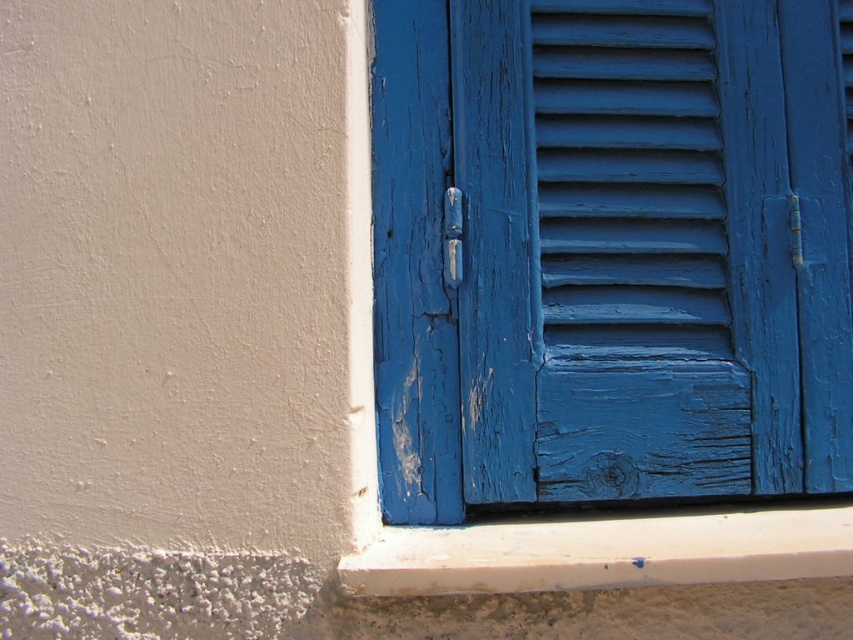
Can you confirm if blue painted wood shutter at center is positioned to the left of blue painted wood shutter at right?

In fact, blue painted wood shutter at center is to the right of blue painted wood shutter at right.

Is blue painted wood shutter at center in front of blue painted wood shutter at right?

No, it is not.

The image size is (853, 640). Describe the element at coordinates (633, 256) in the screenshot. I see `blue painted wood shutter at center` at that location.

I want to click on blue painted wood shutter at center, so click(x=633, y=256).

Does blue painted wood shutter at right have a greater width compared to white matte window sill at lower center?

No.

Does blue painted wood shutter at right come in front of white matte window sill at lower center?

No, it is behind white matte window sill at lower center.

Which is in front, point (364, 8) or point (450, 570)?

Point (450, 570) is in front.

You are a GUI agent. You are given a task and a screenshot of the screen. Output one action in this format:
    pyautogui.click(x=<x>, y=<y>)
    Task: Click on the blue painted wood shutter at right
    This screenshot has width=853, height=640.
    Given the screenshot: What is the action you would take?
    coord(537,520)

Does point (706, 129) come farther from viewer compared to point (508, 548)?

Yes, point (706, 129) is behind point (508, 548).

Which is behind, point (665, 234) or point (369, 548)?

Positioned behind is point (665, 234).

Which is in front, point (648, 419) or point (840, 528)?

Positioned in front is point (840, 528).

Where is `blue painted wood shutter at center`? This screenshot has height=640, width=853. blue painted wood shutter at center is located at coordinates pyautogui.click(x=633, y=256).